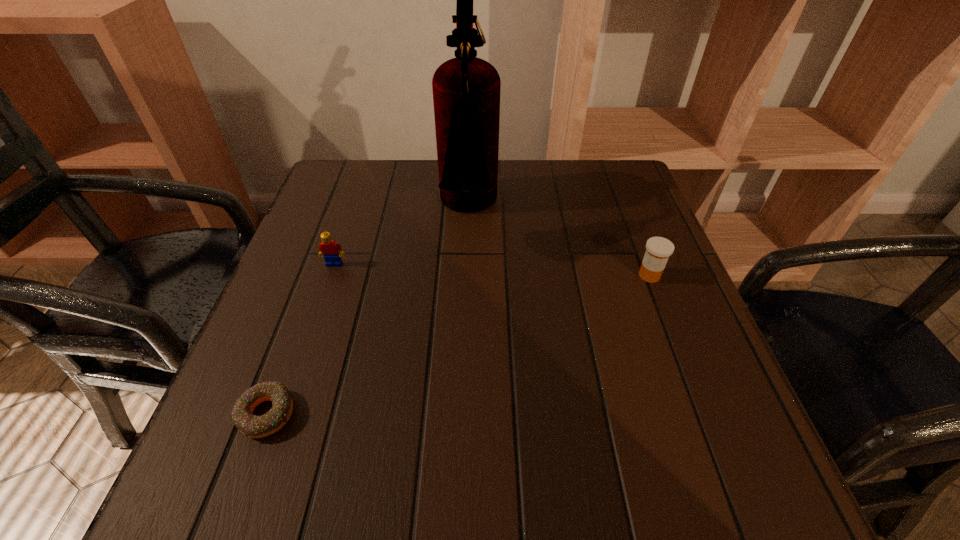
At what (x,y) coordinates should I click in order to perform the action: click on the tallest object. Please return your answer as a coordinate pair (x, y). Looking at the image, I should click on (466, 90).

Where is `fire extinguisher`? This screenshot has width=960, height=540. fire extinguisher is located at coordinates (466, 90).

Find the location of a particular element. This screenshot has width=960, height=540. Lego is located at coordinates (328, 248).

The image size is (960, 540). I want to click on medicine, so click(658, 249).

The image size is (960, 540). In order to click on the nearest object in this screenshot , I will do `click(253, 426)`.

The image size is (960, 540). In order to click on doughnut in this screenshot , I will do `click(253, 426)`.

The height and width of the screenshot is (540, 960). I want to click on free space located 0.360m at the nozzle of the fire extinguisher, so click(x=646, y=210).

Find the location of a particular element. free spot located on the front-facing side of the Lego is located at coordinates (304, 354).

You are a GUI agent. You are given a task and a screenshot of the screen. Output one action in this format:
    pyautogui.click(x=<x>, y=<y>)
    Task: Click on the blank space located 0.190m on the label of the rightmost object
    
    Given the screenshot: What is the action you would take?
    pyautogui.click(x=545, y=275)

Find the location of a particular element. The image size is (960, 540). free space located on the label of the rightmost object is located at coordinates (569, 275).